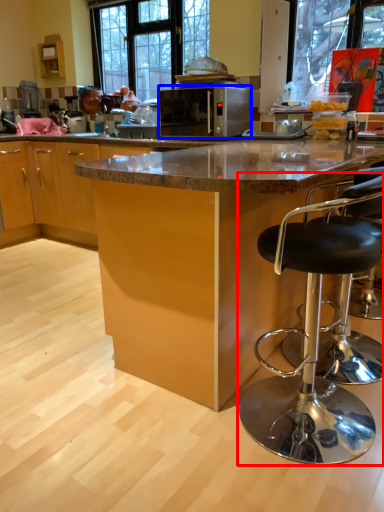
Question: Which of the following is the farthest to the observer, chair (highlighted by a red box) or microwave oven (highlighted by a blue box)?

Choices:
 (A) chair
 (B) microwave oven

Answer: (B)